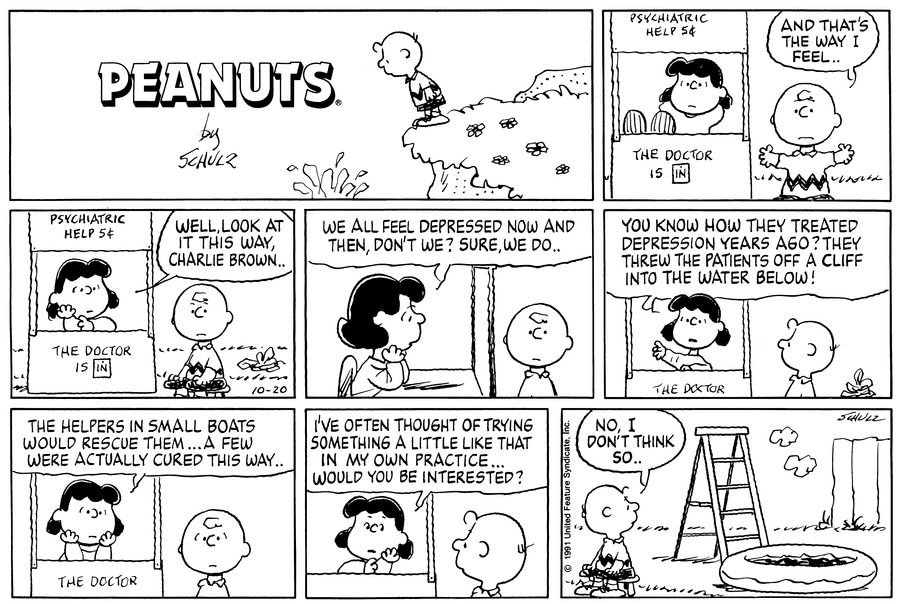
This screenshot has width=900, height=604. Find the location of `panel`. panel is located at coordinates (358, 92), (761, 71), (245, 310), (533, 292), (781, 313), (236, 500), (327, 510), (654, 495).